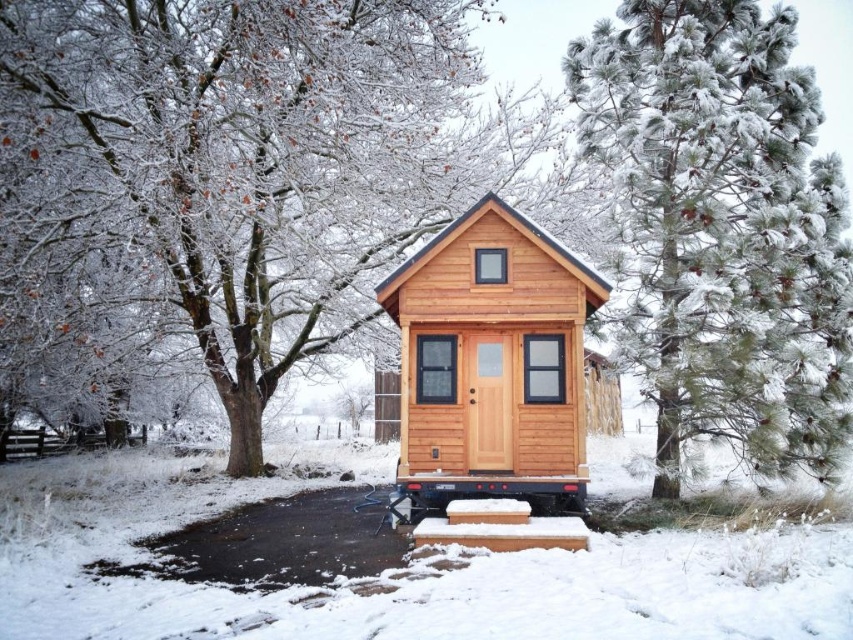
Is snow-covered pine tree at right bigger than natural wood cabin at center?

Incorrect, snow-covered pine tree at right is not larger than natural wood cabin at center.

Is snow-covered pine tree at right taller than natural wood cabin at center?

Incorrect, snow-covered pine tree at right's height is not larger of natural wood cabin at center's.

Is point (809, 234) in front of point (500, 358)?

Yes.

Locate an element on the screen. snow-covered pine tree at right is located at coordinates (723, 230).

Between point (428, 220) and point (752, 403), which one is positioned in front?

Point (752, 403) is in front.

Is snow-covered bark tree at upper left positioned behind snow-covered pine tree at right?

No, it is not.

Locate an element on the screen. snow-covered bark tree at upper left is located at coordinates (258, 156).

Can you confirm if snow-covered bark tree at upper left is smaller than natural wood cabin at center?

No, snow-covered bark tree at upper left is not smaller than natural wood cabin at center.

Is snow-covered bark tree at upper left positioned before natural wood cabin at center?

Yes, snow-covered bark tree at upper left is closer to the viewer.

Describe the element at coordinates (258, 156) in the screenshot. I see `snow-covered bark tree at upper left` at that location.

I want to click on snow-covered bark tree at upper left, so click(258, 156).